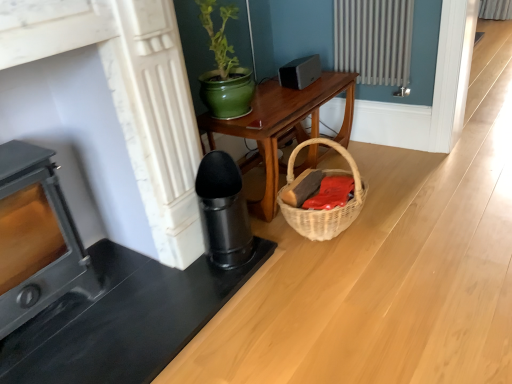
Question: Considering the relative sizes of satin black speaker at upper center and metallic gray heater at left in the image provided, is satin black speaker at upper center bigger than metallic gray heater at left?

Choices:
 (A) yes
 (B) no

Answer: (B)

Question: Are satin black speaker at upper center and metallic gray heater at left far apart?

Choices:
 (A) yes
 (B) no

Answer: (A)

Question: Can you see satin black speaker at upper center touching metallic gray heater at left?

Choices:
 (A) no
 (B) yes

Answer: (A)

Question: Does satin black speaker at upper center have a greater width compared to metallic gray heater at left?

Choices:
 (A) no
 (B) yes

Answer: (A)

Question: Is satin black speaker at upper center at the right side of metallic gray heater at left?

Choices:
 (A) yes
 (B) no

Answer: (A)

Question: From the image's perspective, would you say satin black speaker at upper center is positioned over metallic gray heater at left?

Choices:
 (A) no
 (B) yes

Answer: (B)

Question: Does woven basket at lower right lie behind metallic gray heater at left?

Choices:
 (A) yes
 (B) no

Answer: (A)

Question: Is woven basket at lower right positioned far away from metallic gray heater at left?

Choices:
 (A) no
 (B) yes

Answer: (B)

Question: Does woven basket at lower right appear on the left side of metallic gray heater at left?

Choices:
 (A) no
 (B) yes

Answer: (A)

Question: From the image's perspective, is woven basket at lower right over metallic gray heater at left?

Choices:
 (A) yes
 (B) no

Answer: (A)

Question: Considering the relative sizes of woven basket at lower right and metallic gray heater at left in the image provided, is woven basket at lower right thinner than metallic gray heater at left?

Choices:
 (A) yes
 (B) no

Answer: (A)

Question: Is metallic gray heater at left a part of woven basket at lower right?

Choices:
 (A) no
 (B) yes

Answer: (A)

Question: From the image's perspective, is woven basket at lower right on wooden table at center?

Choices:
 (A) no
 (B) yes

Answer: (A)